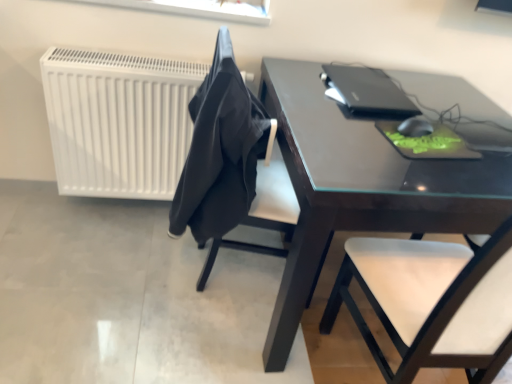
The image size is (512, 384). Identify the location of free space to the back side of black matte mouse at upper right. (404, 110).